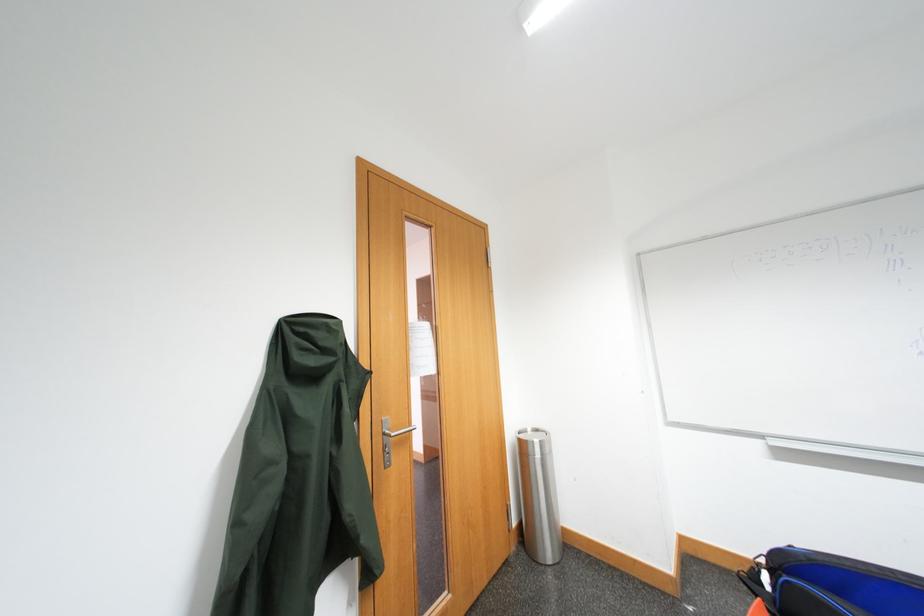
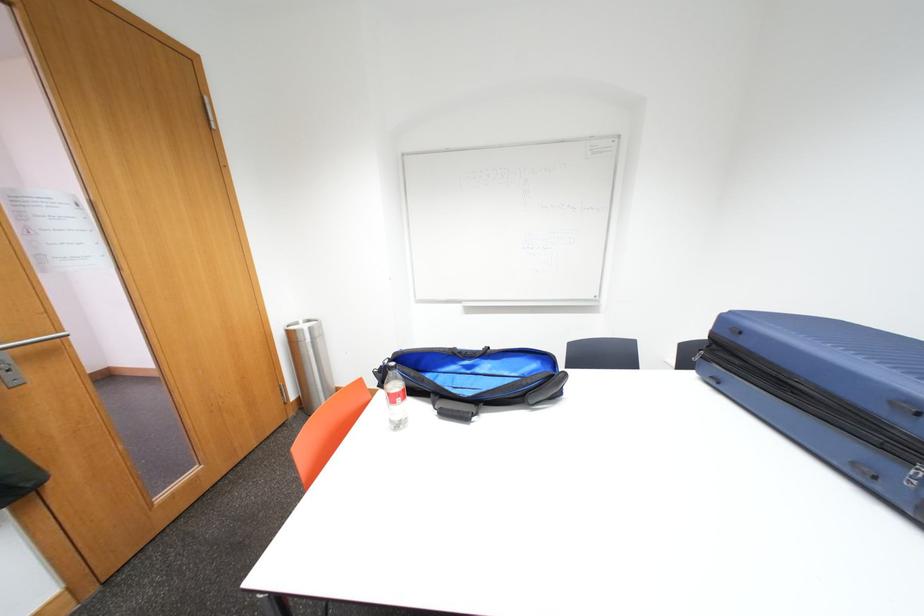
Based on the continuous images, in which direction is the camera rotating?

The camera rotated toward right-down.